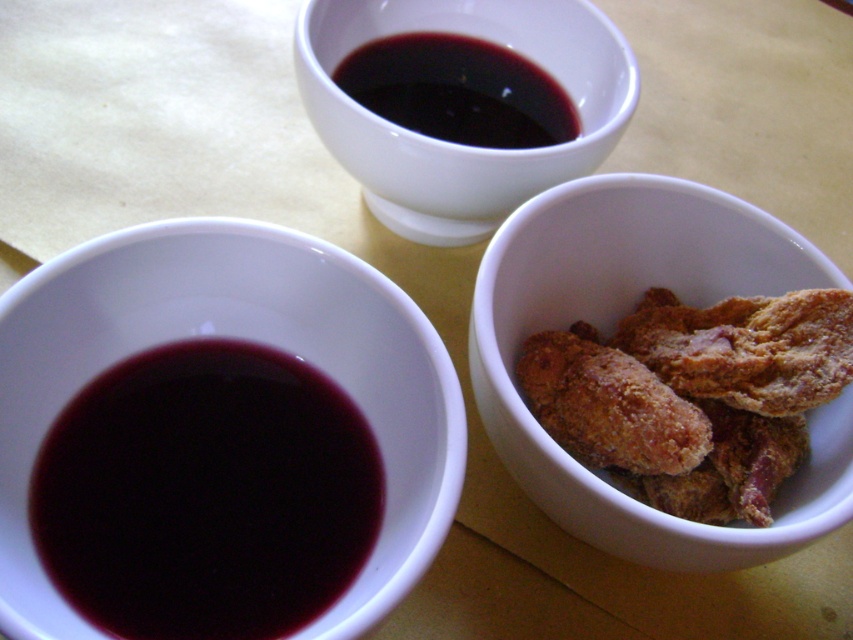
You are a chef preparing a dish and need to pour the dark glossy sauce at upper center into the dark red matte bowl at left. Based on the scene, will the bowl be tall enough to hold the sauce without spilling?

The dark red matte bowl at left has a greater height compared to the dark glossy sauce at upper center, so the bowl will be tall enough to hold the sauce without spilling.